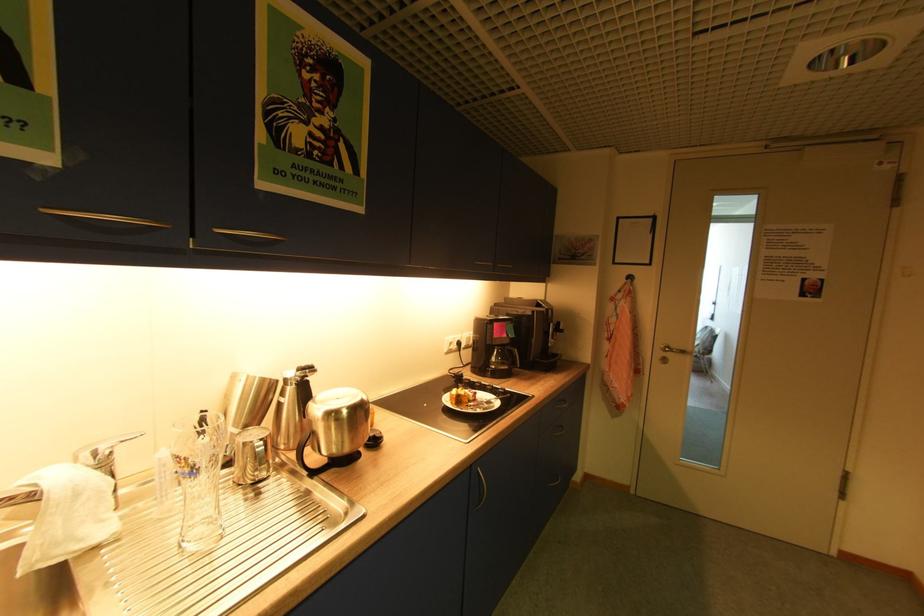
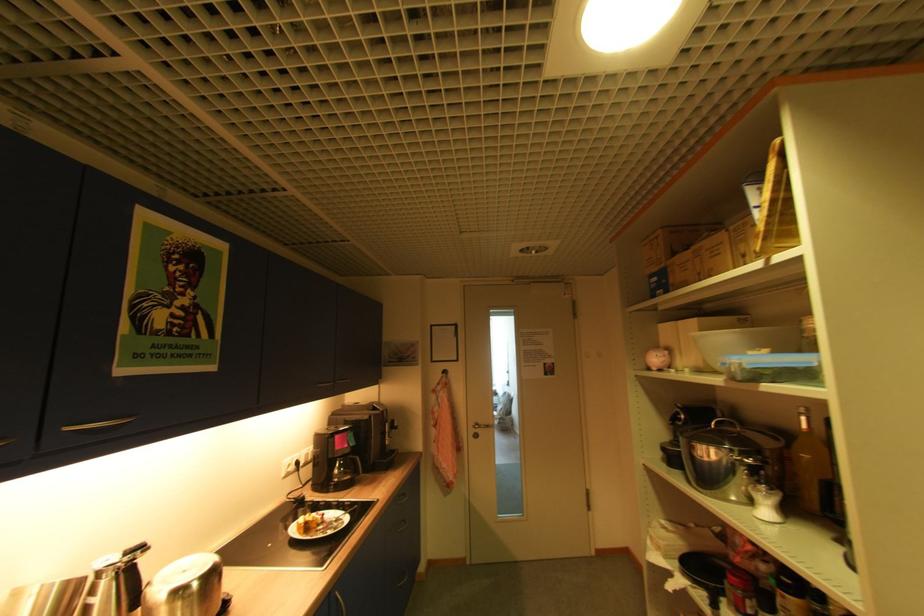
Find the pixel in the second image that matches the point at 675,357 in the first image.

(484, 431)